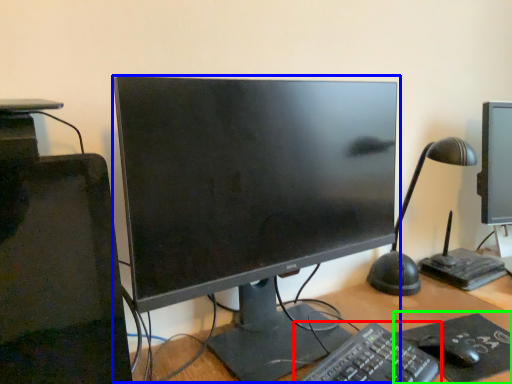
Question: Based on their relative distances, which object is nearer to computer keyboard (highlighted by a red box)? Choose from computer monitor (highlighted by a blue box) and mousepad (highlighted by a green box).

Choices:
 (A) computer monitor
 (B) mousepad

Answer: (B)